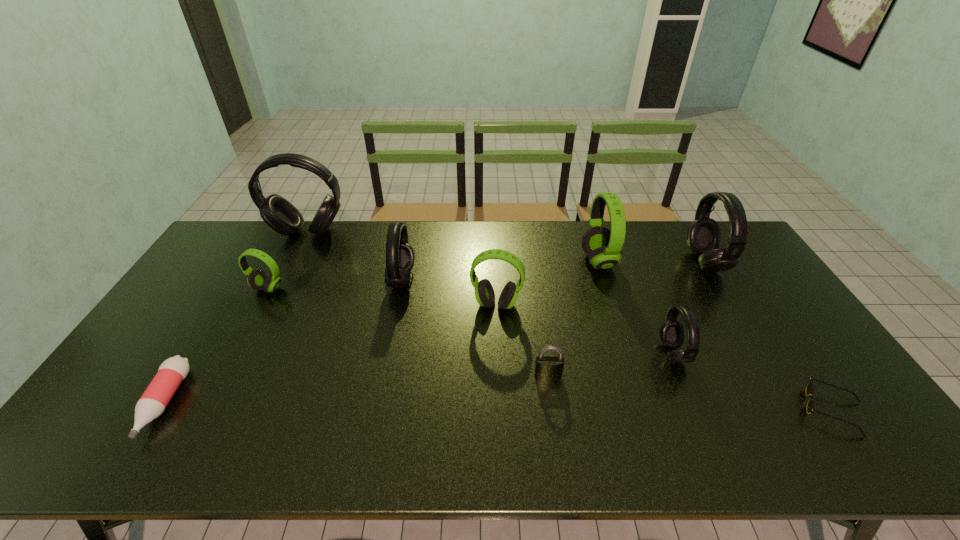
This screenshot has width=960, height=540. What are the coordinates of `free space located 0.170m on the front of the black padlock` in the screenshot? It's located at [x=557, y=439].

At what (x,y) coordinates should I click in order to perform the action: click on free location located on the lenses of the black sunglasses. Please return your answer as a coordinate pair (x, y). The image size is (960, 540). Looking at the image, I should click on (680, 410).

This screenshot has height=540, width=960. I want to click on vacant region located on the lenses of the black sunglasses, so click(671, 410).

You are a GUI agent. You are given a task and a screenshot of the screen. Output one action in this format:
    pyautogui.click(x=<x>, y=<y>)
    Task: Click on the vacant region located 0.290m on the lenses of the black sunglasses
    The width and height of the screenshot is (960, 540).
    Given the screenshot: What is the action you would take?
    pyautogui.click(x=684, y=410)

The image size is (960, 540). I want to click on bottle situated at the near edge, so 153,402.

You are a GUI agent. You are given a task and a screenshot of the screen. Output one action in this format:
    pyautogui.click(x=<x>, y=<y>)
    Task: Click on the sunglasses present at the near edge
    The height and width of the screenshot is (540, 960).
    Given the screenshot: What is the action you would take?
    pyautogui.click(x=810, y=387)

Where is `headset located at the left edge`? The image size is (960, 540). headset located at the left edge is located at coordinates (278, 213).

Image resolution: width=960 pixels, height=540 pixels. What are the coordinates of `bottle located in the left edge section of the desktop` in the screenshot? It's located at (153, 402).

This screenshot has width=960, height=540. What are the coordinates of `headset situated at the right edge` in the screenshot? It's located at (703, 234).

Find the location of a particular element. This screenshot has height=540, width=960. sunglasses present at the right edge is located at coordinates (810, 387).